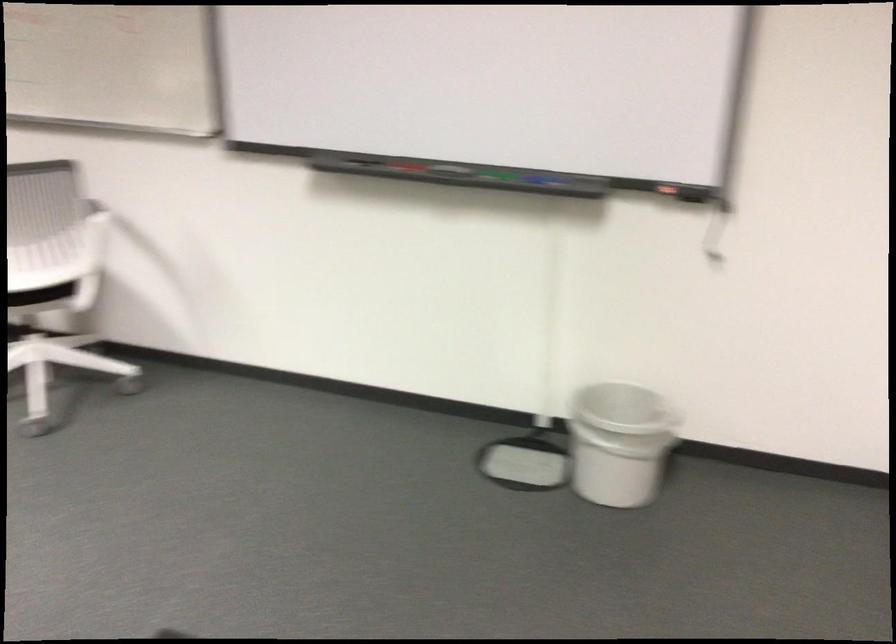
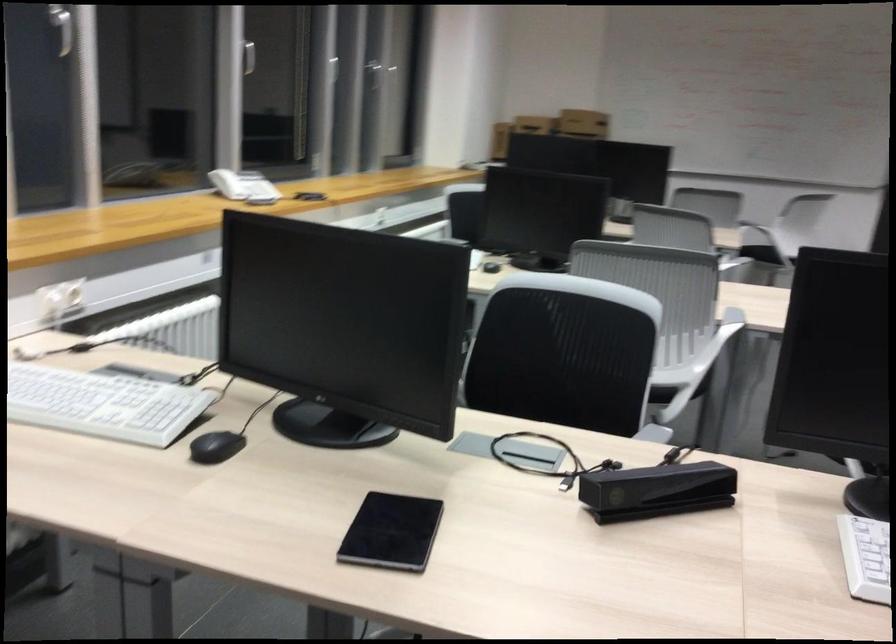
Question: I am providing you with two images of the same scene from different viewpoints. After the viewpoint changes to image2, which objects are now occluded?

Choices:
 (A) projector cart handle
 (B) telephone handset
 (C) black sensor device
 (D) chair sitting surface

Answer: (D)